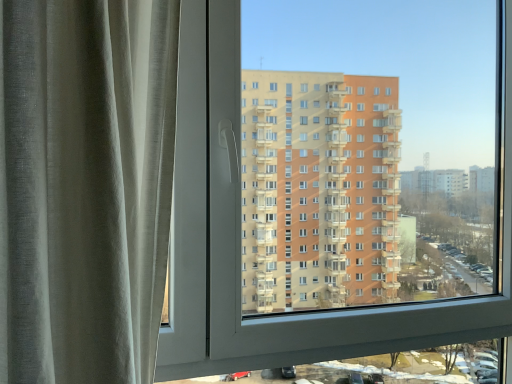
Find the location of `white plastic window at center`. white plastic window at center is located at coordinates (240, 239).

This screenshot has width=512, height=384. What do you see at coordinates (240, 239) in the screenshot?
I see `white plastic window at center` at bounding box center [240, 239].

Identify the location of white plastic window at center. (240, 239).